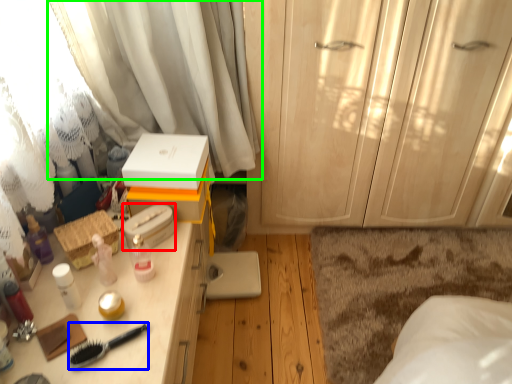
Question: Which is nearer to the storage box (highlighted by a red box)? brush (highlighted by a blue box) or curtain (highlighted by a green box).

Choices:
 (A) brush
 (B) curtain

Answer: (A)